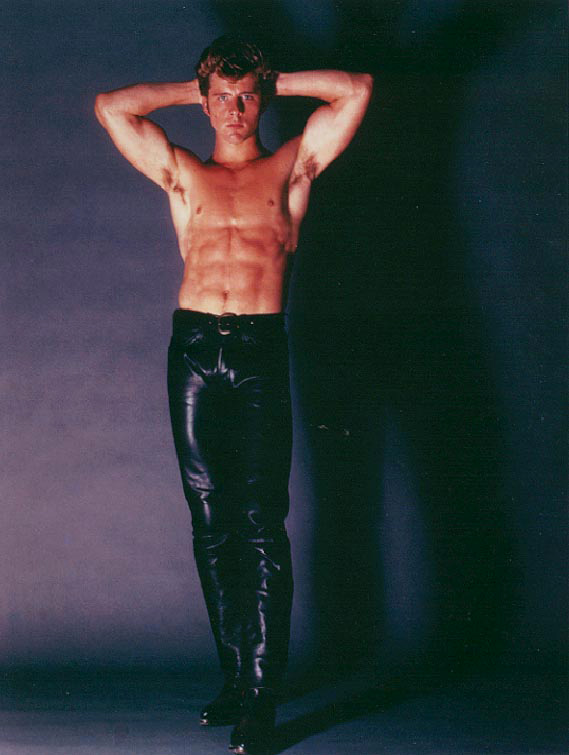
This screenshot has width=569, height=755. What are the coordinates of `wall shadow to the right and back of male model` in the screenshot? It's located at (302, 723), (321, 673), (387, 692), (347, 524), (329, 359), (362, 242), (407, 134), (453, 393), (461, 504), (465, 643).